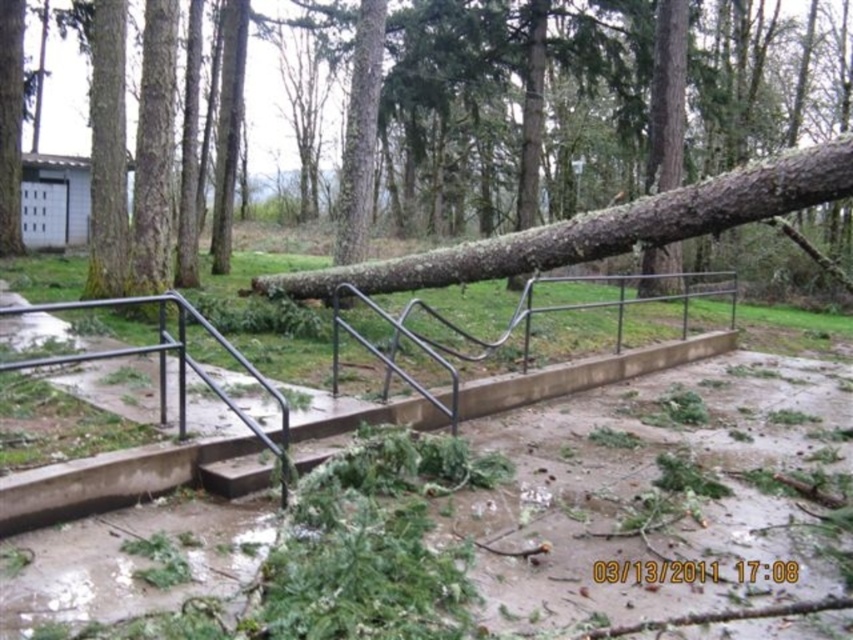
Question: Considering the relative positions of brown rough bark tree at center and black metal rail at center in the image provided, where is brown rough bark tree at center located with respect to black metal rail at center?

Choices:
 (A) left
 (B) right

Answer: (A)

Question: Can you confirm if brown rough bark tree at center is wider than black metal rail at center?

Choices:
 (A) no
 (B) yes

Answer: (B)

Question: Which object appears closest to the camera in this image?

Choices:
 (A) black metal rail at center
 (B) brown rough bark tree at center

Answer: (B)

Question: Is brown rough bark tree at center smaller than black metal rail at center?

Choices:
 (A) no
 (B) yes

Answer: (A)